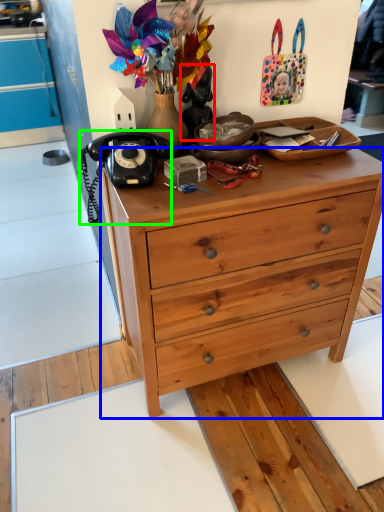
Question: Which object is positioned closest to person (highlighted by a red box)? Select from desk (highlighted by a blue box) and corded phone (highlighted by a green box).

Choices:
 (A) desk
 (B) corded phone

Answer: (B)